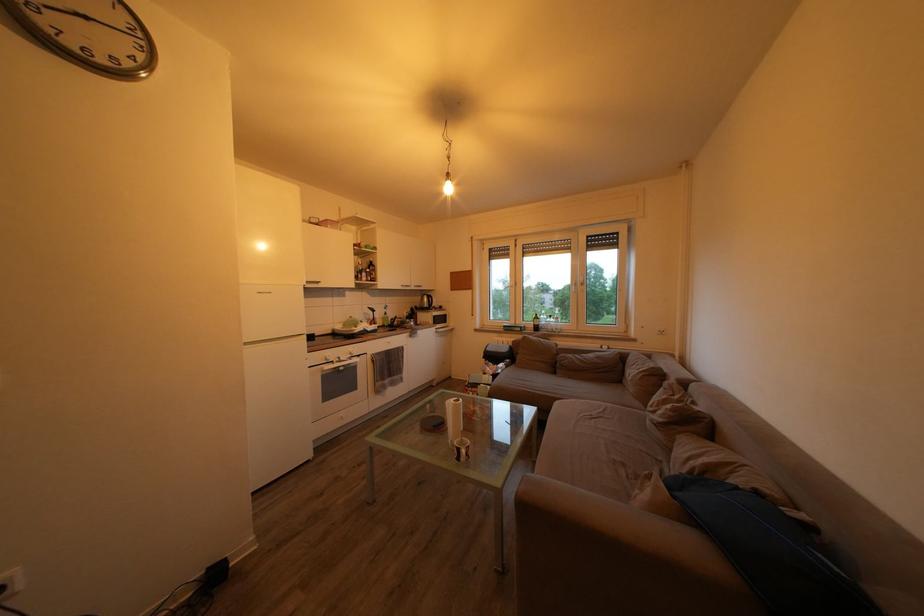
Which object does [460,448] point to?

This point indicates the brown and white mug.